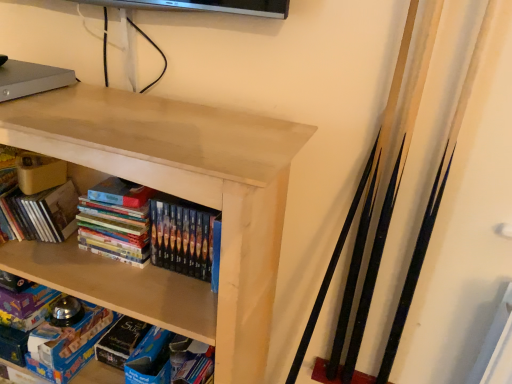
Question: Is matte cardboard book at upper left, which is the first book in left-to-right order, far from blue matte board game at lower left?

Choices:
 (A) yes
 (B) no

Answer: (B)

Question: Is matte cardboard book at upper left, which appears as the 2th book when viewed from the right, closer to camera compared to blue matte board game at lower left?

Choices:
 (A) yes
 (B) no

Answer: (A)

Question: From the image's perspective, is matte cardboard book at upper left, which appears as the 2th book when viewed from the right, above blue matte board game at lower left?

Choices:
 (A) no
 (B) yes

Answer: (B)

Question: Can you confirm if matte cardboard book at upper left, which is the first book in left-to-right order, is thinner than blue matte board game at lower left?

Choices:
 (A) yes
 (B) no

Answer: (A)

Question: Considering the relative sizes of matte cardboard book at upper left, which appears as the 2th book when viewed from the right, and blue matte board game at lower left in the image provided, is matte cardboard book at upper left, which appears as the 2th book when viewed from the right, taller than blue matte board game at lower left?

Choices:
 (A) yes
 (B) no

Answer: (A)

Question: From a real-world perspective, relative to matte wood shelf at upper center, is multicolored glossy books at center, placed as the 1th book when sorted from right to left, vertically above or below?

Choices:
 (A) below
 (B) above

Answer: (B)

Question: Is multicolored glossy books at center, positioned as the 2th book in left-to-right order, taller or shorter than matte wood shelf at upper center?

Choices:
 (A) short
 (B) tall

Answer: (A)

Question: Considering their positions, is multicolored glossy books at center, placed as the 1th book when sorted from right to left, located in front of or behind matte wood shelf at upper center?

Choices:
 (A) front
 (B) behind

Answer: (B)

Question: Considering the positions of multicolored glossy books at center, positioned as the 2th book in left-to-right order, and matte wood shelf at upper center in the image, is multicolored glossy books at center, positioned as the 2th book in left-to-right order, bigger or smaller than matte wood shelf at upper center?

Choices:
 (A) small
 (B) big

Answer: (A)

Question: Relative to matte cardboard book at upper left, which is the first book in left-to-right order, is blue matte board game at lower left in front or behind?

Choices:
 (A) front
 (B) behind

Answer: (B)

Question: In terms of width, does blue matte board game at lower left look wider or thinner when compared to matte cardboard book at upper left, which appears as the 2th book when viewed from the right?

Choices:
 (A) wide
 (B) thin

Answer: (A)

Question: Is point (102, 329) closer or farther from the camera than point (5, 162)?

Choices:
 (A) farther
 (B) closer

Answer: (A)

Question: Based on their sizes in the image, would you say blue matte board game at lower left is bigger or smaller than matte cardboard book at upper left, which appears as the 2th book when viewed from the right?

Choices:
 (A) small
 (B) big

Answer: (A)

Question: Considering the positions of matte cardboard book at upper left, which is the first book in left-to-right order, and matte wood shelf at upper center in the image, is matte cardboard book at upper left, which is the first book in left-to-right order, taller or shorter than matte wood shelf at upper center?

Choices:
 (A) tall
 (B) short

Answer: (B)

Question: Is matte cardboard book at upper left, which is the first book in left-to-right order, in front of or behind matte wood shelf at upper center in the image?

Choices:
 (A) front
 (B) behind

Answer: (B)